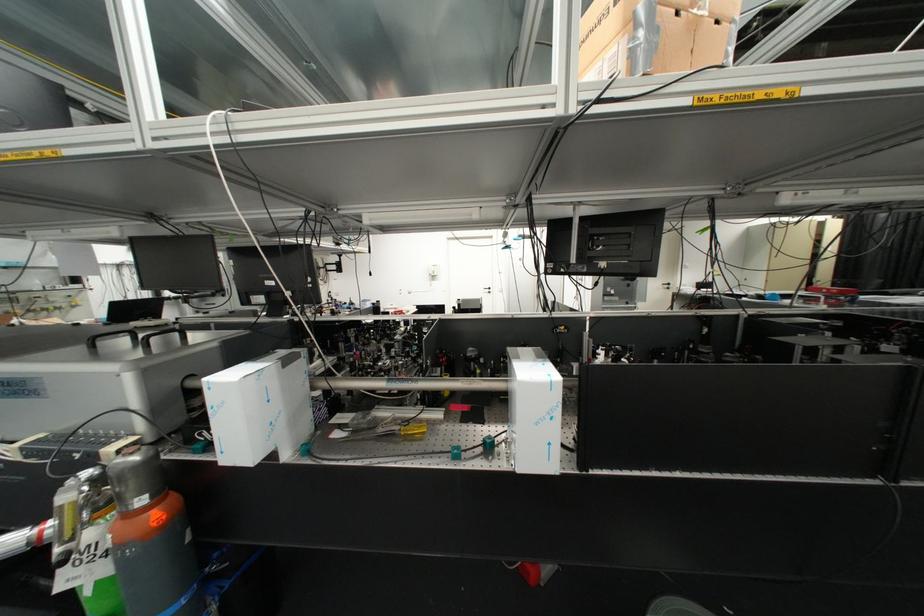
What do you see at coordinates (488, 444) in the screenshot? This screenshot has width=924, height=616. I see `the black adjustment knob` at bounding box center [488, 444].